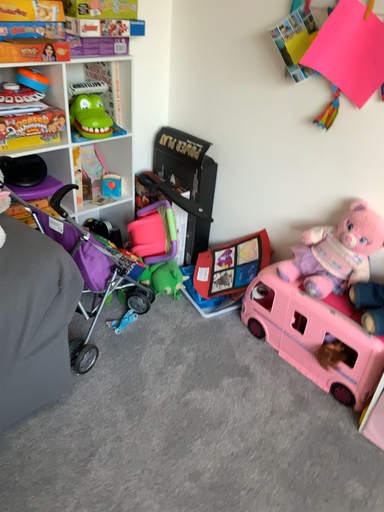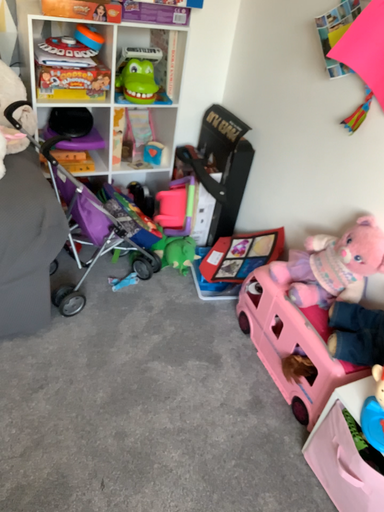
Question: How did the camera likely rotate when shooting the video?

Choices:
 (A) rotated left
 (B) rotated right

Answer: (A)